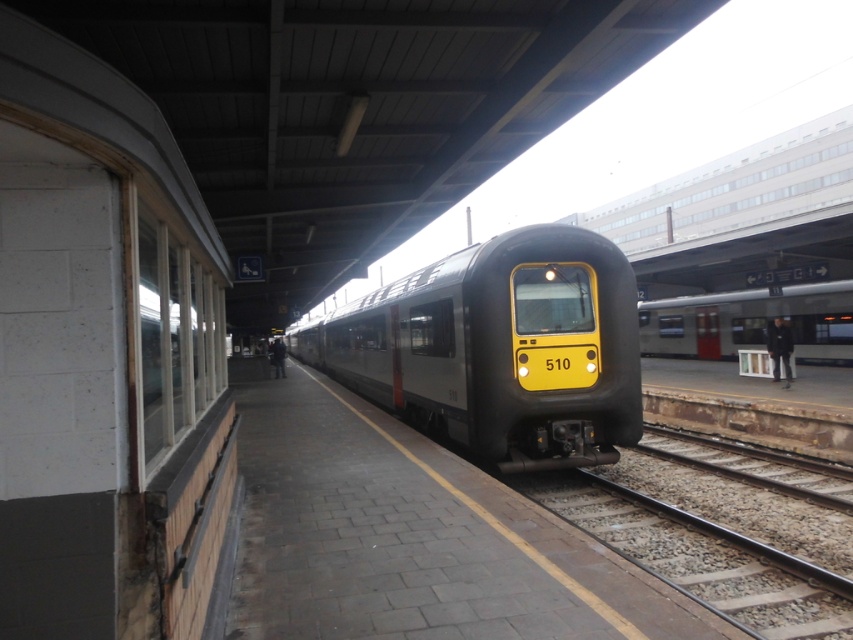
You are a maintenance worker needing to inspect the smooth steel train track at center. The metallic silver train at center is currently parked on the tracks. Can you safely walk between the train and the edge of the platform to reach the track for inspection? The platform edge is 50 feet away from the train.

The distance between the smooth steel train track at center and metallic silver train at center is 49.75 feet. Since the platform edge is 50 feet away from the train, there is enough space for you to walk safely between the train and the edge of the platform to inspect the track.

Looking at this image, you are a commuter waiting at the train station. You notice two trains, the matte black train at center and the metallic silver train at center. Which train is positioned lower in the image?

The matte black train at center is positioned lower than the metallic silver train at center in the image.

You are a passenger waiting at the train station. You notice the matte black train at center and the smooth steel train track at center. Which object is closer to you as you stand on the platform?

The matte black train at center is closer to you than the smooth steel train track at center because it is positioned further to the viewer.